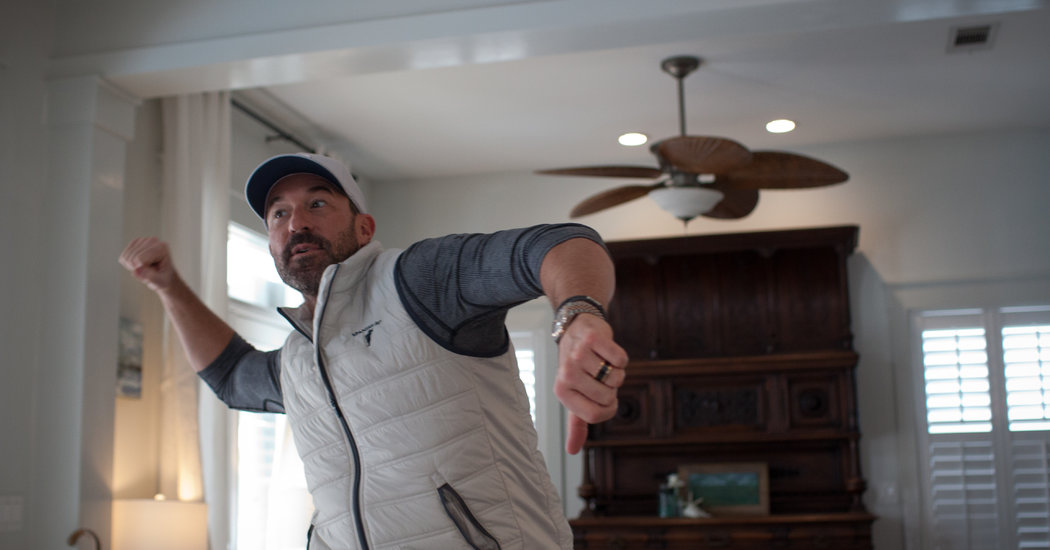
Where is `white wall`? The width and height of the screenshot is (1050, 550). white wall is located at coordinates [436, 203], [989, 208].